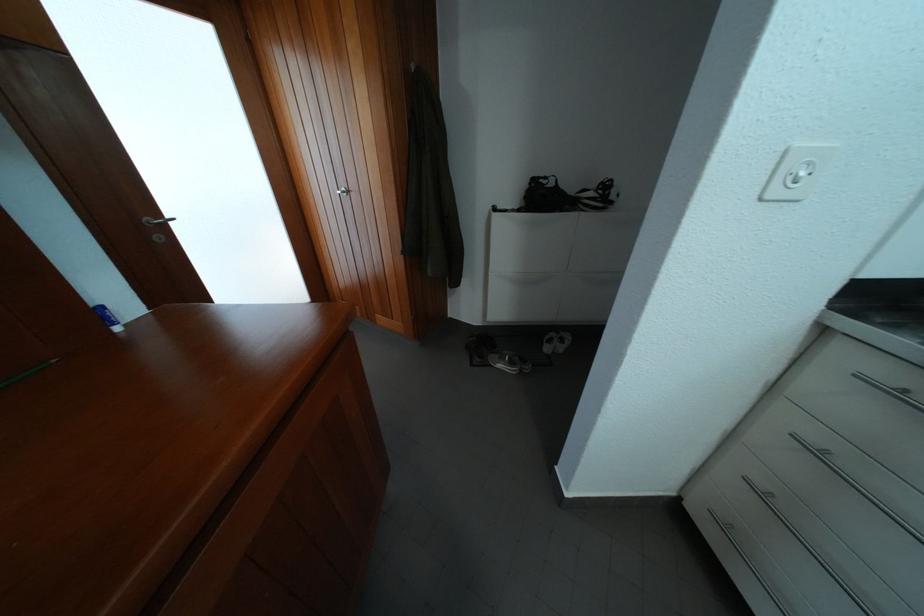
Find where to insert the power outlet socket. Please return your answer as a coordinate pair (x, y).

(797, 172)